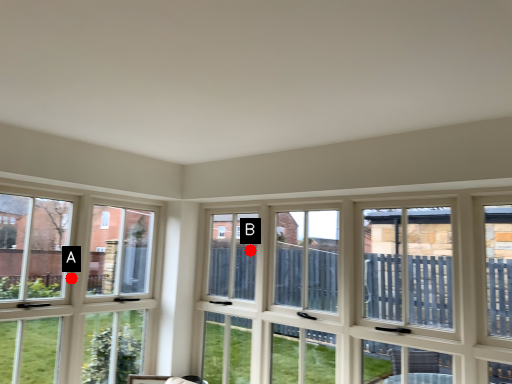
Question: Two points are circled on the image, labeled by A and B beside each circle. Which point is farther to the camera?

Choices:
 (A) A is further
 (B) B is further

Answer: (B)